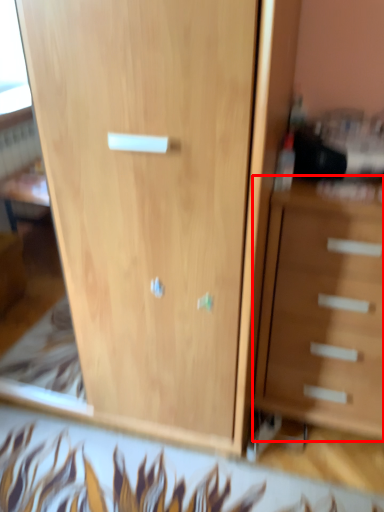
Question: In this image, where is chest of drawers (annotated by the red box) located relative to cupboard?

Choices:
 (A) right
 (B) left

Answer: (A)